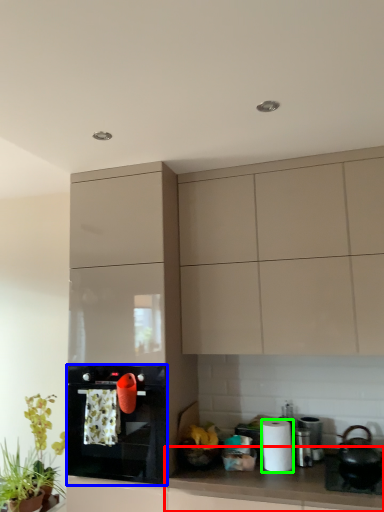
Question: Based on their relative distances, which object is nearer to countertop (highlighted by a red box)? Choose from kitchen appliance (highlighted by a blue box) and paper towel (highlighted by a green box).

Choices:
 (A) kitchen appliance
 (B) paper towel

Answer: (B)